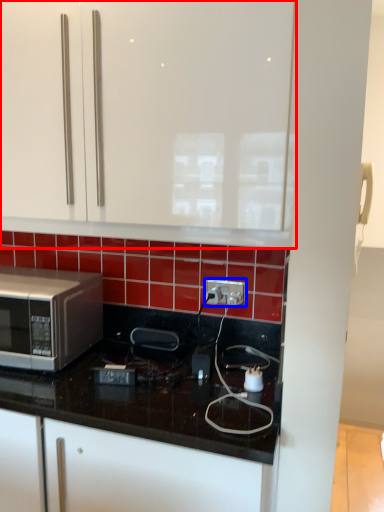
Question: Which point is closer to the camera, cabinetry (highlighted by a red box) or electric outlet (highlighted by a blue box)?

Choices:
 (A) cabinetry
 (B) electric outlet

Answer: (A)